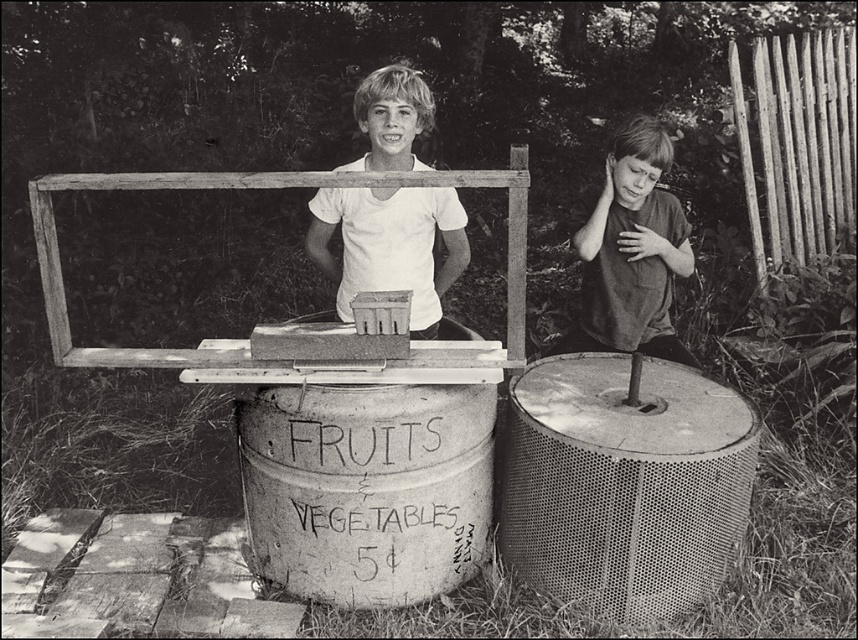
In the scene shown: Who is more distant from viewer, (415, 74) or (591, 244)?

The point (591, 244) is more distant.

I want to click on white matte shirt at center, so click(x=390, y=244).